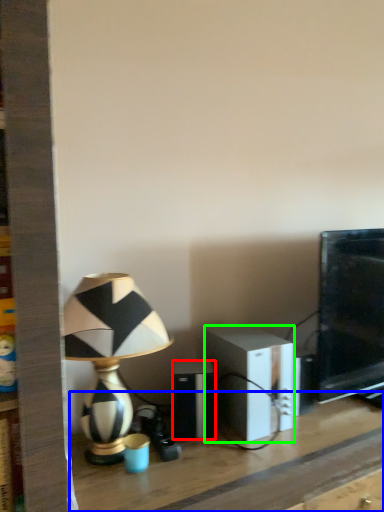
Question: Considering the real-world distances, which object is closest to speaker (highlighted by a red box)? table (highlighted by a blue box) or speaker (highlighted by a green box).

Choices:
 (A) table
 (B) speaker

Answer: (B)